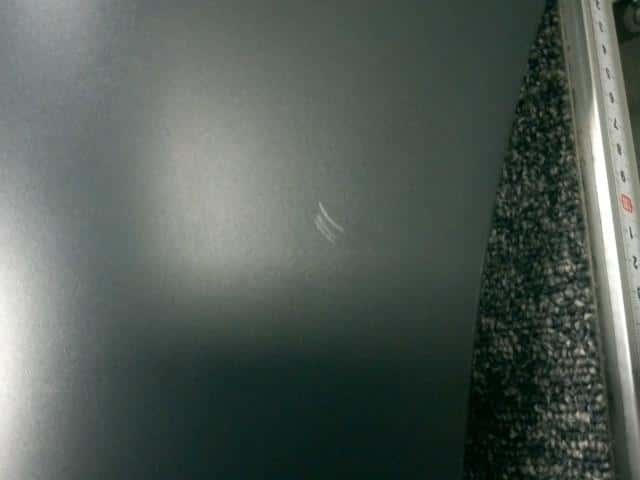
You are a GUI agent. You are given a task and a screenshot of the screen. Output one action in this format:
    pyautogui.click(x=<x>, y=<y>)
    Task: Click on the carpet
    The image size is (640, 480).
    Given the screenshot: What is the action you would take?
    pyautogui.click(x=531, y=373)